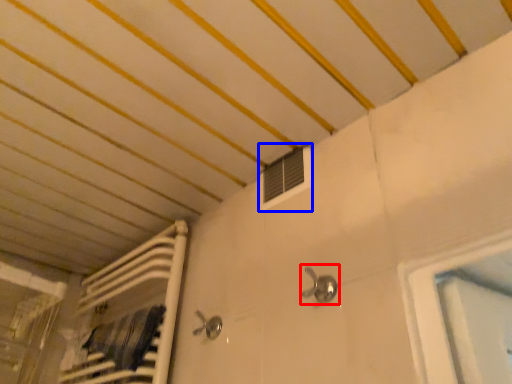
Question: Which of the following is the closest to the observer, faucet (highlighted by a red box) or air conditioning (highlighted by a blue box)?

Choices:
 (A) faucet
 (B) air conditioning

Answer: (A)